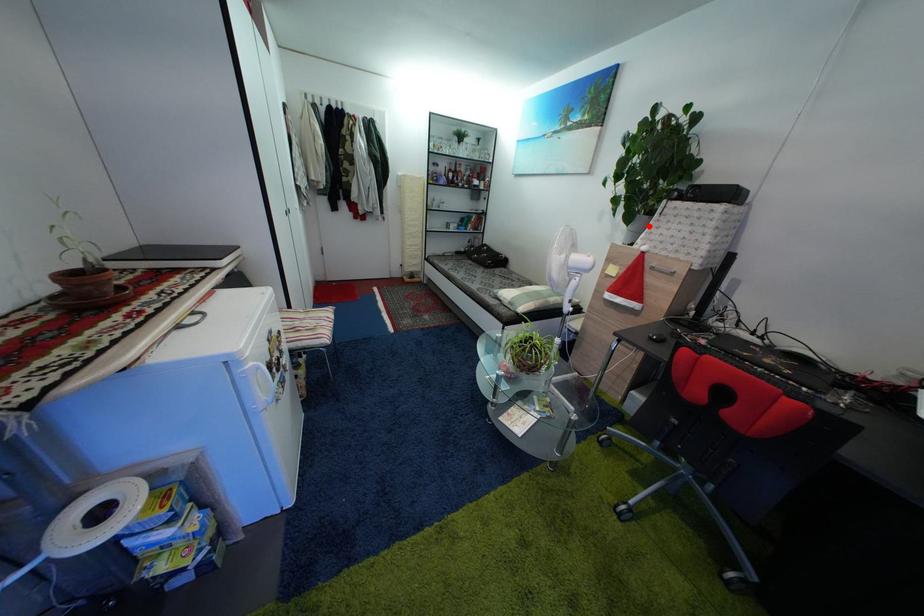
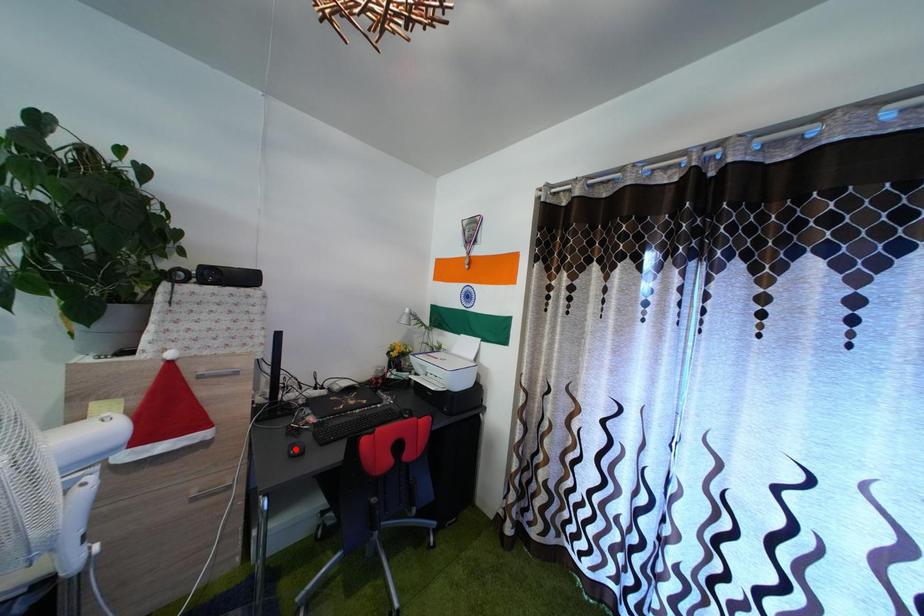
I am providing you with two images of the same scene from different viewpoints. A red point is marked on the first image and another point is marked on the second image. Are the points marked in image1 and image2 representing the same 3D position?

No